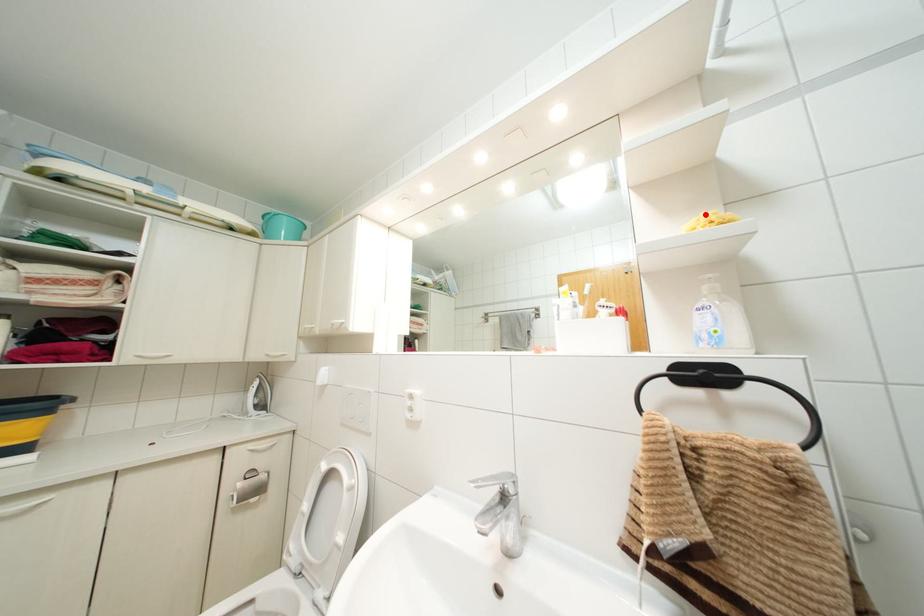
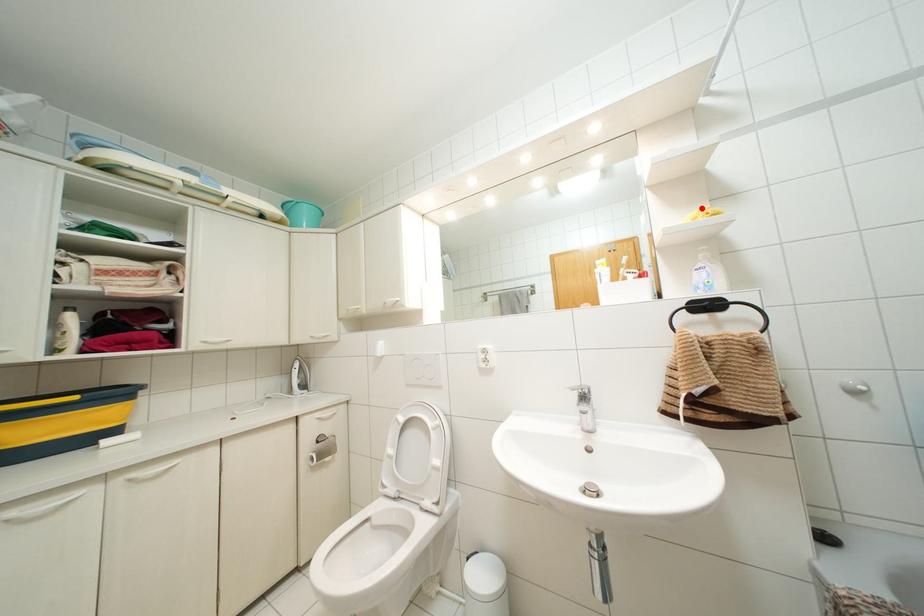
I am providing you with two images of the same scene from different viewpoints. A red point is marked on the first image and another point is marked on the second image. Do the highlighted points in image1 and image2 indicate the same real-world spot?

Yes